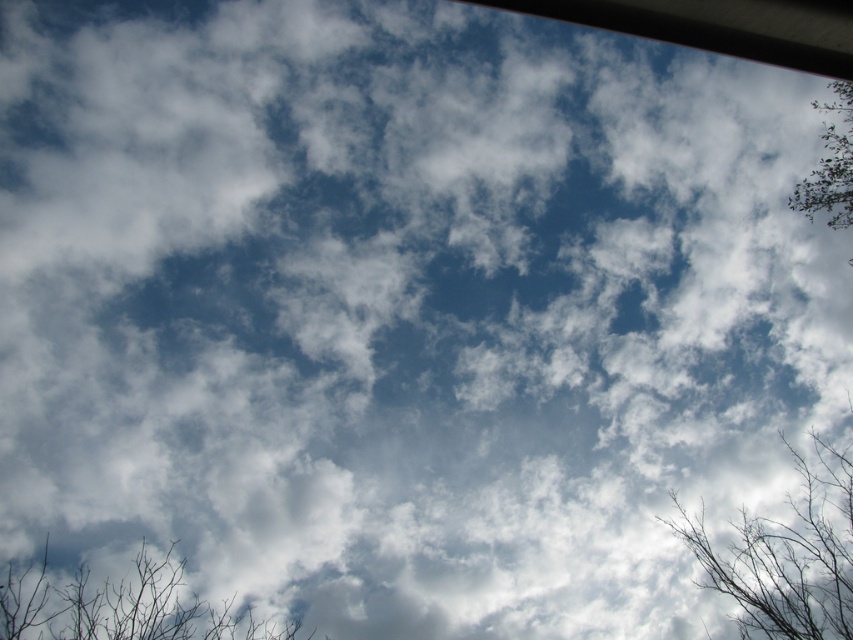
You are a bird flying over the scene. You see the bare branches at lower right and the green leafy tree at upper right. Which one appears bigger to you from your current position?

The bare branches at lower right appears larger in size than the green leafy tree at upper right from your current position.